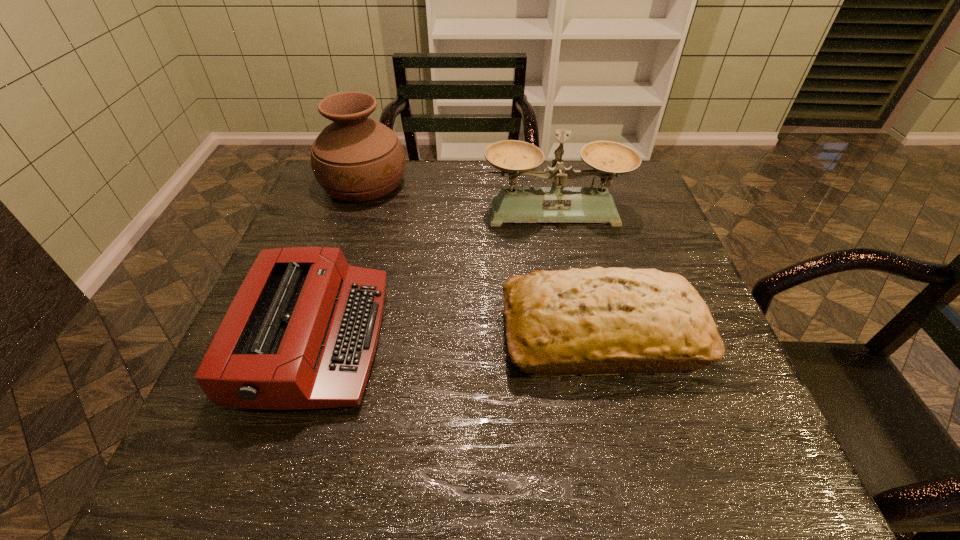
The width and height of the screenshot is (960, 540). In the image, there is a desktop. What are the coordinates of `free region at the far right corner` in the screenshot? It's located at 615,204.

The image size is (960, 540). Identify the location of vacant space in between the scale and the shortest object. (435, 275).

Find the location of a particular element. This screenshot has height=540, width=960. free space between the scale and the typewriter is located at coordinates (435, 275).

Locate an element on the screen. vacant region between the scale and the urn is located at coordinates (459, 198).

Where is `free spot between the scale and the urn`? free spot between the scale and the urn is located at coordinates (459, 198).

At what (x,y) coordinates should I click in order to perform the action: click on free space between the urn and the scale. Please return your answer as a coordinate pair (x, y). Image resolution: width=960 pixels, height=540 pixels. Looking at the image, I should click on (459, 198).

Point out which object is positioned as the third nearest to the urn. Please provide its 2D coordinates. Your answer should be formatted as a tuple, i.e. [(x, y)], where the tuple contains the x and y coordinates of a point satisfying the conditions above.

[(595, 321)]

Locate which object is the second closest to the urn. Please provide its 2D coordinates. Your answer should be formatted as a tuple, i.e. [(x, y)], where the tuple contains the x and y coordinates of a point satisfying the conditions above.

[(301, 333)]

Identify the location of vacant space that satisfies the following two spatial constraints: 1. on the front-facing side of the scale; 2. on the typing side of the typewriter. This screenshot has width=960, height=540. (580, 339).

Identify the location of blank space that satisfies the following two spatial constraints: 1. on the front-facing side of the scale; 2. on the typing side of the typewriter. The width and height of the screenshot is (960, 540). (580, 339).